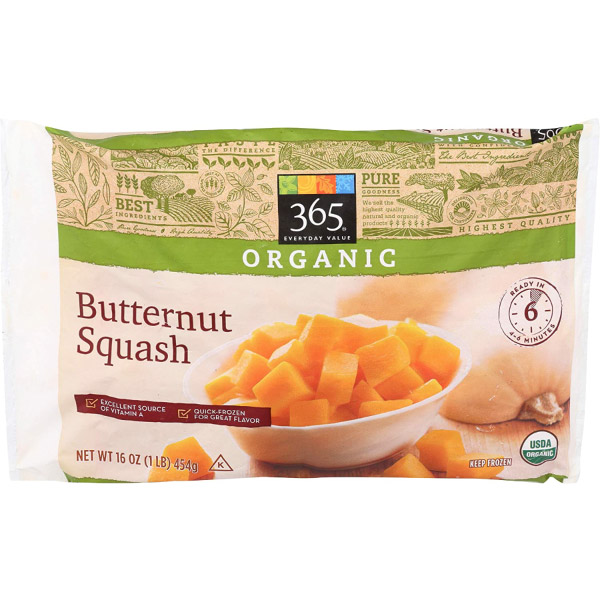
Locate an element on the screen. The image size is (600, 600). white bowl is located at coordinates (355, 446).